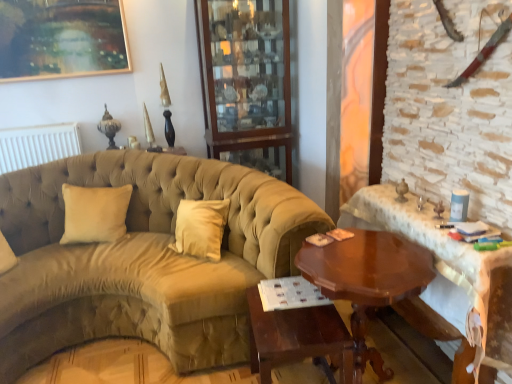
Find the location of a particular element. free space above shiny brown wood table at right, which is the first table in right-to-left order (from a real-world perspective) is located at coordinates (428, 216).